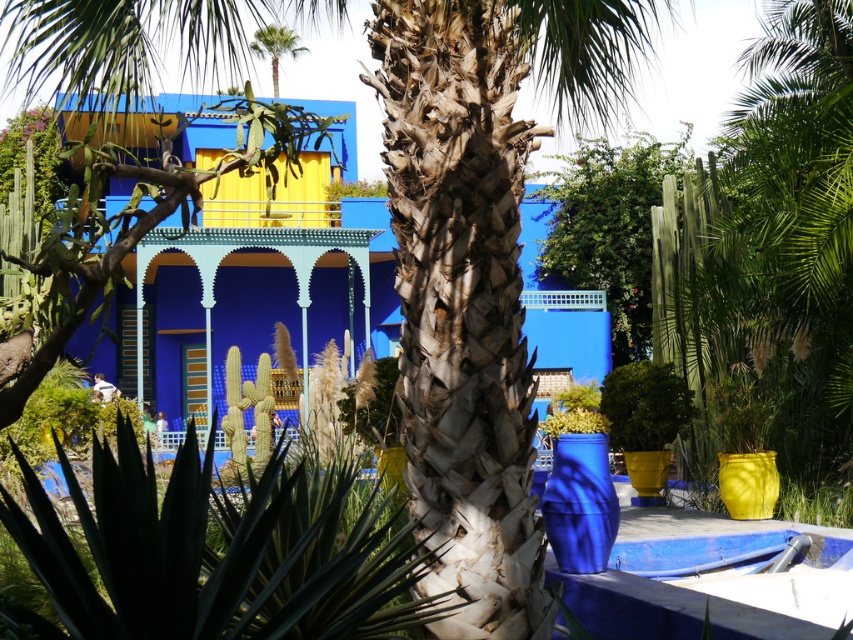
You are standing in the garden and want to take a photo of both the blue glossy building at center and the green leafy palm tree at upper center. Which object should you position to the left side of your camera frame to include both in the shot?

You should position the green leafy palm tree at upper center to the left side of your camera frame because the blue glossy building at center is on its right side, so placing the palm tree on the left will allow both to fit in the frame.

You are a landscape architect planning to install a new pathway between the blue glossy building at center and the green leafy palm tree at upper center. The pathway requires a minimum of 25 feet of space. Based on the scene, can the pathway be installed without any adjustments?

The blue glossy building at center is 27.42 feet from the green leafy palm tree at upper center. Since the required minimum space is 25 feet, the pathway can be installed as the distance is sufficient.

You are planning to install a new light fixture in the garden. The light needs to be placed above the leathery brown palm trunk at center without blocking the view of the green leafy palm tree at upper center. Can you position the light in such a way that it illuminates the palm trunk but doesn

The leathery brown palm trunk at center is not as tall as the green leafy palm tree at upper center. Therefore, placing the light fixture above the palm trunk would naturally position it below the taller green leafy palm tree at upper center, allowing it to illuminate the trunk while keeping the tree visible.